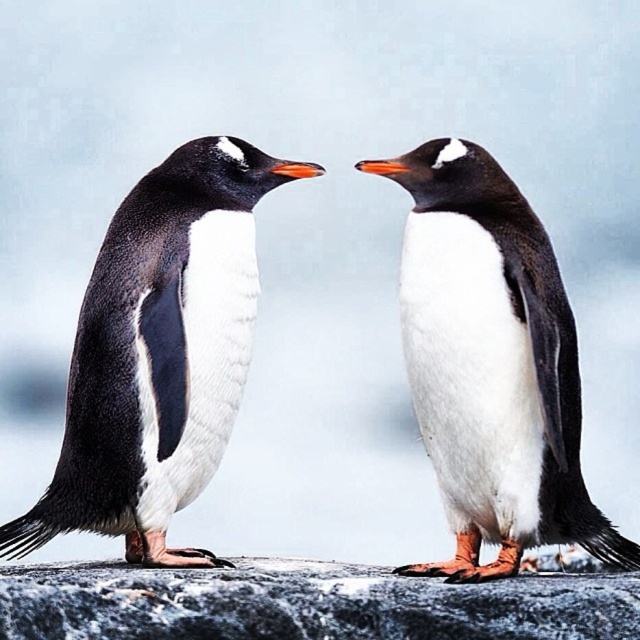
Can you confirm if black matte penguin at left is taller than gray rough stone at center?

Yes, black matte penguin at left is taller than gray rough stone at center.

At what (x,y) coordinates should I click in order to perform the action: click on black matte penguin at left. Please return your answer as a coordinate pair (x, y). Looking at the image, I should click on (160, 353).

Is the position of white matte penguin at center less distant than that of gray rough stone at center?

No, it is behind gray rough stone at center.

Between white matte penguin at center and gray rough stone at center, which one has less height?

Standing shorter between the two is gray rough stone at center.

Measure the distance between white matte penguin at center and camera.

white matte penguin at center is 2.40 meters away from camera.

The width and height of the screenshot is (640, 640). Identify the location of white matte penguin at center. (492, 364).

Is black matte penguin at left positioned at the back of white matte penguin at center?

That is True.

Does point (248, 316) lie behind point (404, 156)?

No, it is not.

This screenshot has height=640, width=640. Find the location of `black matte penguin at left`. black matte penguin at left is located at coordinates (160, 353).